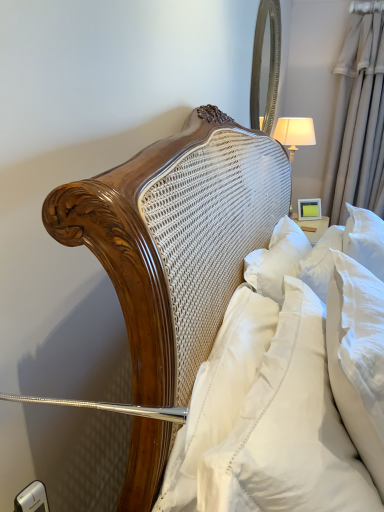
Question: Is white satin pillow at center, the first pillow in the back-to-front sequence, located outside white fabric lampshade at upper right?

Choices:
 (A) no
 (B) yes

Answer: (B)

Question: Is the depth of white satin pillow at center, which ranks as the third pillow in front-to-back order, less than that of white fabric lampshade at upper right?

Choices:
 (A) no
 (B) yes

Answer: (B)

Question: From the image's perspective, is white satin pillow at center, the first pillow in the back-to-front sequence, located beneath white fabric lampshade at upper right?

Choices:
 (A) yes
 (B) no

Answer: (A)

Question: From the image's perspective, is white satin pillow at center, the first pillow in the back-to-front sequence, on top of white fabric lampshade at upper right?

Choices:
 (A) no
 (B) yes

Answer: (A)

Question: Is white satin pillow at center, the first pillow in the back-to-front sequence, to the left of white fabric lampshade at upper right from the viewer's perspective?

Choices:
 (A) no
 (B) yes

Answer: (B)

Question: Considering the relative positions of silky beige curtain at right and white fabric lampshade at upper right in the image provided, is silky beige curtain at right to the left or to the right of white fabric lampshade at upper right?

Choices:
 (A) right
 (B) left

Answer: (A)

Question: Does point (367, 54) appear closer or farther from the camera than point (299, 117)?

Choices:
 (A) closer
 (B) farther

Answer: (A)

Question: Is silky beige curtain at right inside the boundaries of white fabric lampshade at upper right, or outside?

Choices:
 (A) outside
 (B) inside

Answer: (A)

Question: From their relative heights in the image, would you say silky beige curtain at right is taller or shorter than white fabric lampshade at upper right?

Choices:
 (A) short
 (B) tall

Answer: (B)

Question: Which is correct: white fabric lampshade at upper right is inside white soft pillow at upper right, the first pillow from the front, or outside of it?

Choices:
 (A) outside
 (B) inside

Answer: (A)

Question: Is point (304, 119) positioned closer to the camera than point (314, 461)?

Choices:
 (A) closer
 (B) farther

Answer: (B)

Question: From a real-world perspective, is white fabric lampshade at upper right positioned above or below white soft pillow at upper right, which is counted as the third pillow, starting from the back?

Choices:
 (A) below
 (B) above

Answer: (B)

Question: In terms of height, does white fabric lampshade at upper right look taller or shorter compared to white soft pillow at upper right, which is counted as the third pillow, starting from the back?

Choices:
 (A) short
 (B) tall

Answer: (A)

Question: From a real-world perspective, is white fabric lampshade at upper right positioned above or below silver/metallic mirror at upper right?

Choices:
 (A) below
 (B) above

Answer: (A)

Question: Is point (302, 126) closer or farther from the camera than point (274, 105)?

Choices:
 (A) closer
 (B) farther

Answer: (A)